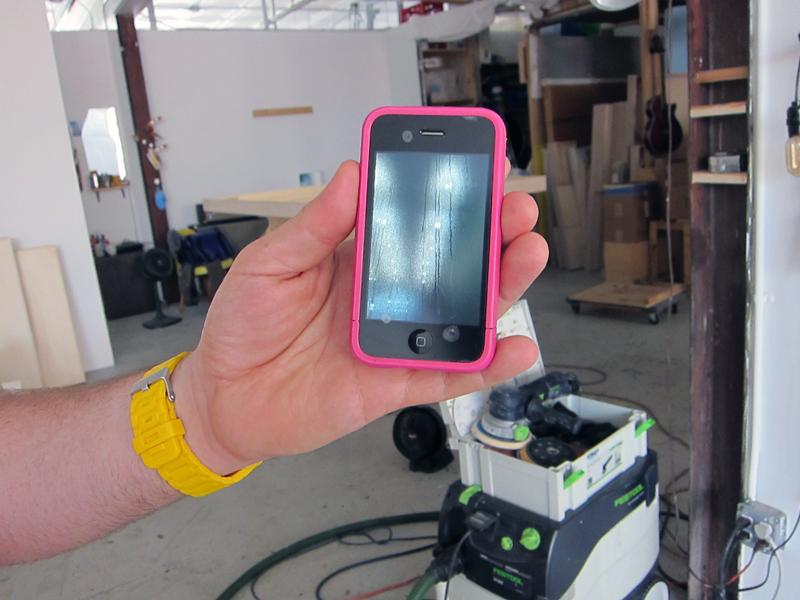
Identify the location of fan. This screenshot has height=600, width=800. (156, 266).